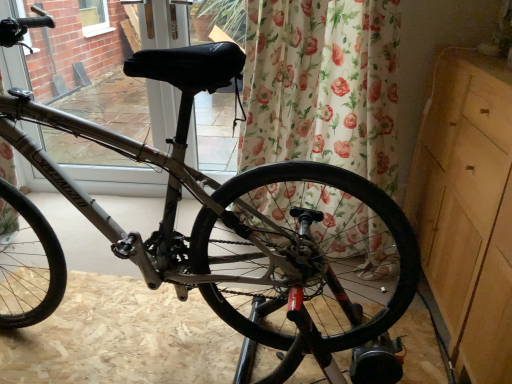
Describe the element at coordinates (122, 337) in the screenshot. I see `black rubber tire at center` at that location.

This screenshot has width=512, height=384. Describe the element at coordinates (118, 180) in the screenshot. I see `black leather seat at upper center` at that location.

Identify the location of floral fabric curtain at center. 322,85.

The width and height of the screenshot is (512, 384). What do you see at coordinates (468, 209) in the screenshot? I see `light wood dresser at right` at bounding box center [468, 209].

The width and height of the screenshot is (512, 384). Identify the location of black rubber tire at center. pos(122,337).

At what (x,y) coordinates should I click in order to perform the action: click on curtain above the light wood dresser at right (from a real-world perspective). Please return your answer as a coordinate pair (x, y). Image resolution: width=512 pixels, height=384 pixels. Looking at the image, I should click on (322, 85).

Is point (481, 230) closer to camera compared to point (343, 164)?

Yes, it is in front of point (343, 164).

Is floral fabric curtain at center at the back of light wood dresser at right?

light wood dresser at right is not turned away from floral fabric curtain at center.

In terms of width, does light wood dresser at right look wider or thinner when compared to floral fabric curtain at center?

Considering their sizes, light wood dresser at right looks broader than floral fabric curtain at center.

Considering the positions of point (179, 32) and point (439, 93), is point (179, 32) closer or farther from the camera than point (439, 93)?

Point (179, 32) is farther from the camera than point (439, 93).

Is black leather seat at upper center facing away from light wood dresser at right?

black leather seat at upper center is not turned away from light wood dresser at right.

Looking at the image, does black leather seat at upper center seem bigger or smaller compared to light wood dresser at right?

Clearly, black leather seat at upper center is smaller in size than light wood dresser at right.

From the picture: Are black leather seat at upper center and black rubber tire at center far apart?

That's right, there is a large distance between black leather seat at upper center and black rubber tire at center.

Considering the positions of points (97, 189) and (89, 358), is point (97, 189) farther from camera compared to point (89, 358)?

Yes, point (97, 189) is farther from viewer.

In the image, is black leather seat at upper center on the left side or the right side of black rubber tire at center?

From the image, it's evident that black leather seat at upper center is to the left of black rubber tire at center.

Which of these two, black leather seat at upper center or black rubber tire at center, is wider?

black rubber tire at center is wider.

Is black leather seat at upper center turned away from floral fabric curtain at center?

No, floral fabric curtain at center is not at the back of black leather seat at upper center.

Which of these two, black leather seat at upper center or floral fabric curtain at center, is wider?

With larger width is floral fabric curtain at center.

This screenshot has width=512, height=384. I want to click on screen door above the floral fabric curtain at center (from the image's perspective), so coord(118,180).

From the image's perspective, would you say black leather seat at upper center is positioned over floral fabric curtain at center?

Yes, from the image's perspective, black leather seat at upper center is over floral fabric curtain at center.

Is black rubber tire at center bigger or smaller than black leather seat at upper center?

Clearly, black rubber tire at center is smaller in size than black leather seat at upper center.

In the scene shown: Considering the positions of objects black rubber tire at center and black leather seat at upper center in the image provided, who is more to the left, black rubber tire at center or black leather seat at upper center?

From the viewer's perspective, black leather seat at upper center appears more on the left side.

Can you confirm if black rubber tire at center is thinner than black leather seat at upper center?

In fact, black rubber tire at center might be wider than black leather seat at upper center.

Which is in front, black rubber tire at center or black leather seat at upper center?

Positioned in front is black rubber tire at center.

Which of these two, black rubber tire at center or light wood dresser at right, stands taller?

Standing taller between the two is light wood dresser at right.

Which is less distant, [135,279] or [511,352]?

Point [135,279] appears to be farther away from the viewer than point [511,352].

Looking at their sizes, would you say black rubber tire at center is wider or thinner than light wood dresser at right?

black rubber tire at center is wider than light wood dresser at right.

Looking at this image, how much distance is there between floral fabric curtain at center and black rubber tire at center?

A distance of 77.09 centimeters exists between floral fabric curtain at center and black rubber tire at center.

From the image's perspective, is floral fabric curtain at center below black rubber tire at center?

Actually, floral fabric curtain at center appears above black rubber tire at center in the image.

Is floral fabric curtain at center positioned with its back to black rubber tire at center?

No, floral fabric curtain at center is not facing away from black rubber tire at center.

Do you think floral fabric curtain at center is within black rubber tire at center, or outside of it?

The correct answer is: outside.

I want to click on dresser below the floral fabric curtain at center (from the image's perspective), so (x=468, y=209).

You are a GUI agent. You are given a task and a screenshot of the screen. Output one action in this format:
    pyautogui.click(x=<x>, y=<y>)
    Task: Click on the dresser on the right side of black leather seat at upper center
    
    Given the screenshot: What is the action you would take?
    pyautogui.click(x=468, y=209)

From the image, which object appears to be farther from black leather seat at upper center, light wood dresser at right or floral fabric curtain at center?

light wood dresser at right lies further to black leather seat at upper center than the other object.

Considering their positions, is light wood dresser at right positioned closer to black leather seat at upper center than black rubber tire at center?

The object closer to black leather seat at upper center is black rubber tire at center.

Which object lies further to the anchor point black leather seat at upper center, black rubber tire at center or light wood dresser at right?

Based on the image, light wood dresser at right appears to be further to black leather seat at upper center.

Looking at the image, which one is located closer to light wood dresser at right, black rubber tire at center or black leather seat at upper center?

The object closer to light wood dresser at right is black rubber tire at center.

When comparing their distances from floral fabric curtain at center, does black rubber tire at center or black leather seat at upper center seem further?

black leather seat at upper center.

From the image, which object appears to be farther from light wood dresser at right, black leather seat at upper center or floral fabric curtain at center?

black leather seat at upper center is positioned further to the anchor light wood dresser at right.

Looking at the image, which one is located closer to floral fabric curtain at center, light wood dresser at right or black rubber tire at center?

Among the two, light wood dresser at right is located nearer to floral fabric curtain at center.

When comparing their distances from black leather seat at upper center, does floral fabric curtain at center or light wood dresser at right seem closer?

floral fabric curtain at center.

At what (x,y) coordinates should I click in order to perform the action: click on curtain between black rubber tire at center and light wood dresser at right in the horizontal direction. Please return your answer as a coordinate pair (x, y). The width and height of the screenshot is (512, 384). Looking at the image, I should click on [322, 85].

Locate an element on the screen. The width and height of the screenshot is (512, 384). curtain between black leather seat at upper center and light wood dresser at right in the horizontal direction is located at coordinates (322, 85).

I want to click on curtain between black leather seat at upper center and black rubber tire at center in the vertical direction, so click(322, 85).

The image size is (512, 384). In order to click on dirt track between black leather seat at upper center and light wood dresser at right from left to right in this screenshot , I will do `click(122, 337)`.